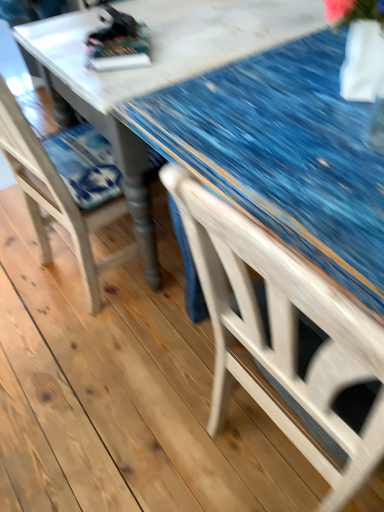
This screenshot has width=384, height=512. I want to click on blank space situated above blue fabric-covered table at center (from a real-world perspective), so click(213, 15).